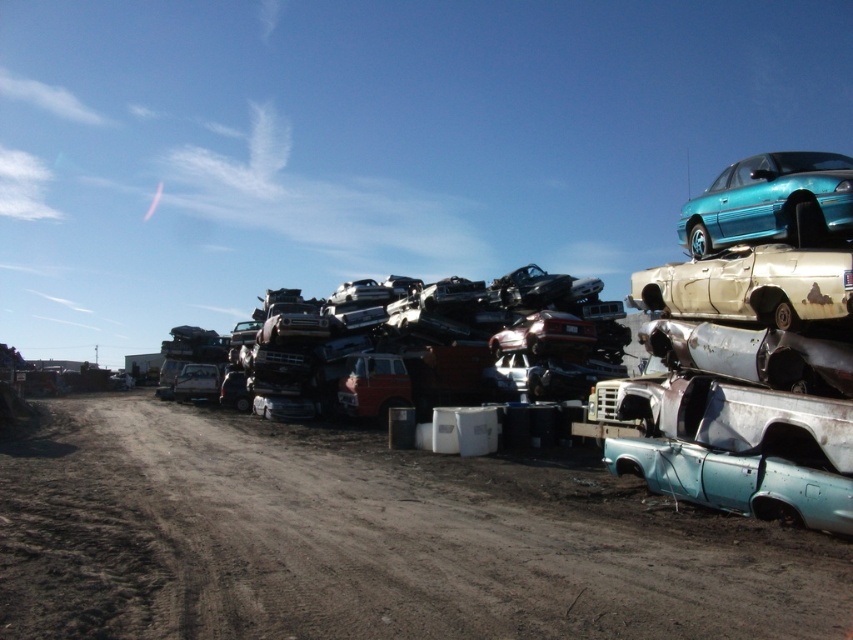
Which of these two, dirt track at lower left or teal glossy car at upper right, stands taller?

teal glossy car at upper right

Where is `dirt track at lower left`? dirt track at lower left is located at coordinates (367, 541).

Identify the location of dirt track at lower left. pos(367,541).